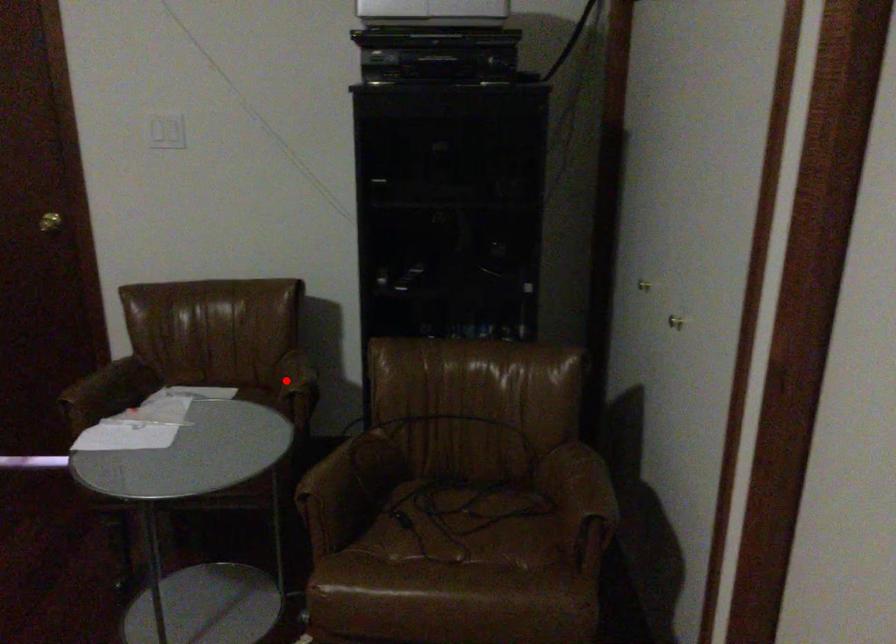
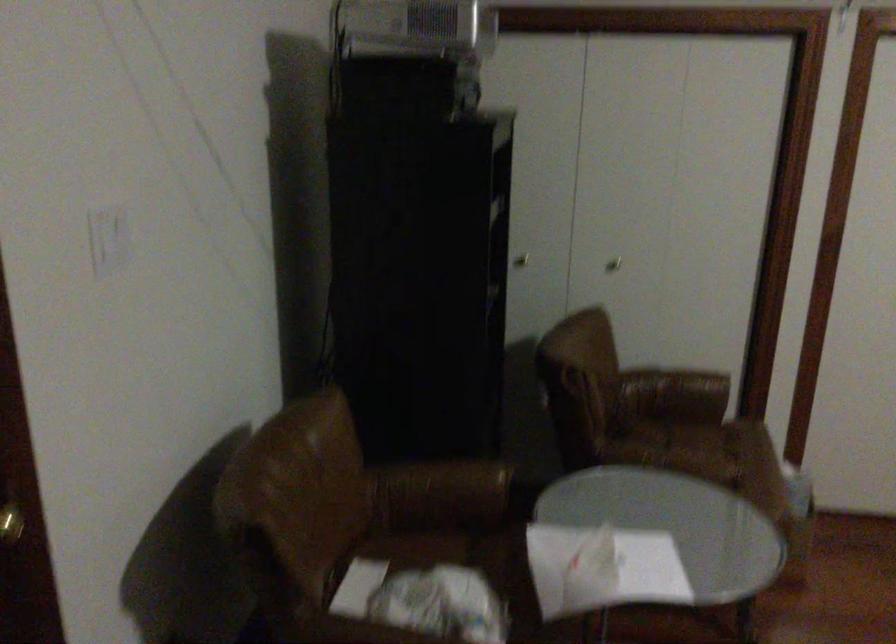
Question: I am providing you with two images of the same scene from different viewpoints. In image1, a red point is highlighted. Considering the same 3D point in image2, which of the following is correct?

Choices:
 (A) It is closer
 (B) It is farther

Answer: (A)